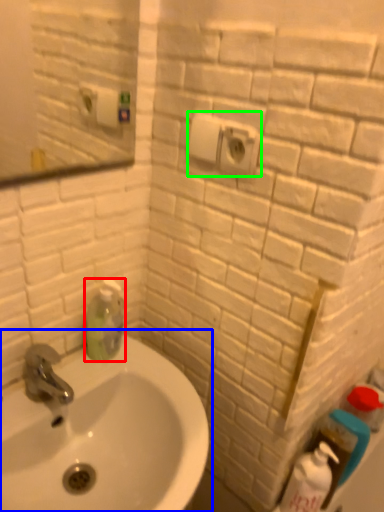
Question: Which object is positioned farthest from cleaning product (highlighted by a red box)? Select from sink (highlighted by a blue box) and electric outlet (highlighted by a green box).

Choices:
 (A) sink
 (B) electric outlet

Answer: (B)